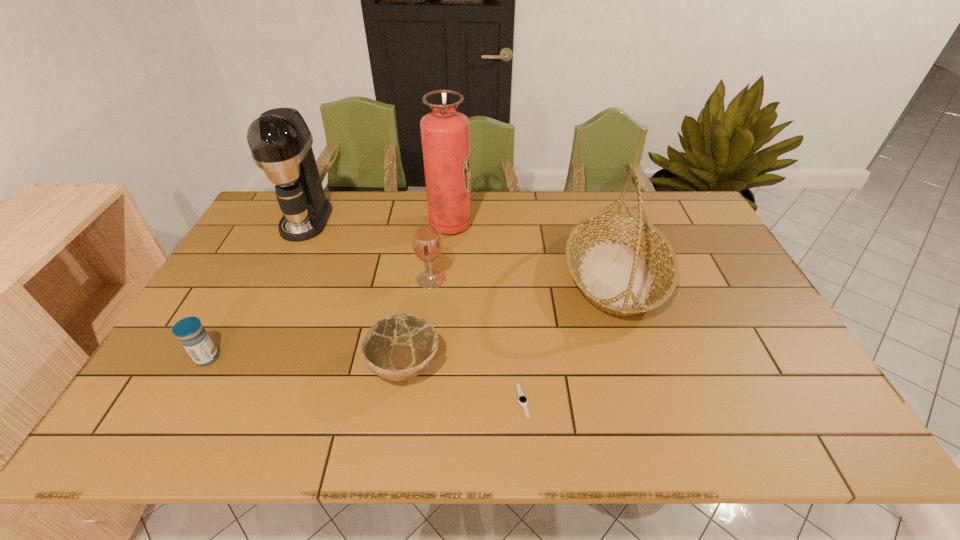
This screenshot has height=540, width=960. I want to click on coffee maker positioned at the left edge, so click(x=280, y=142).

Find the location of a particular element. The height and width of the screenshot is (540, 960). medicine situated at the left edge is located at coordinates (193, 337).

Identify the location of object that is positioned at the far left corner. (280, 142).

You are a GUI agent. You are given a task and a screenshot of the screen. Output one action in this format:
    pyautogui.click(x=<x>, y=<y>)
    Task: Click on the vacant area at the far edge of the desktop
    This screenshot has height=540, width=960.
    Given the screenshot: What is the action you would take?
    pyautogui.click(x=348, y=220)

In the image, there is a desktop. At what (x,y) coordinates should I click in order to perform the action: click on blank space at the near edge. Please return your answer as a coordinate pair (x, y). The width and height of the screenshot is (960, 540). Looking at the image, I should click on (529, 407).

Locate an element on the screen. free location at the left edge of the desktop is located at coordinates (148, 401).

I want to click on free region at the right edge, so click(705, 281).

Image resolution: width=960 pixels, height=540 pixels. In the image, there is a desktop. Identify the location of free region at the far right corner. (657, 195).

You are a GUI agent. You are given a task and a screenshot of the screen. Output one action in this format:
    pyautogui.click(x=<x>, y=<y>)
    Task: Click on the unoccupied area between the wineglass and the second object from right to left
    The image size is (960, 540).
    Given the screenshot: What is the action you would take?
    pyautogui.click(x=477, y=340)

Where is `free space between the watch and the coffee maker`? free space between the watch and the coffee maker is located at coordinates (415, 310).